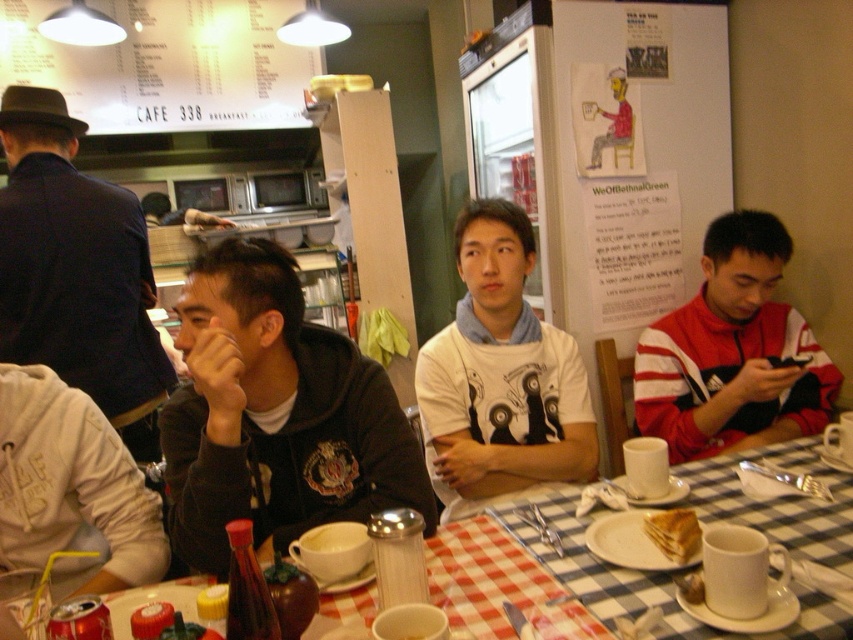
Does translucent plastic bottle at table center appear over golden crispy pastry at lower center?

Yes.

From the picture: Who is lower down, translucent plastic bottle at table center or golden crispy pastry at lower center?

golden crispy pastry at lower center is below.

What do you see at coordinates (247, 589) in the screenshot? I see `translucent plastic bottle at table center` at bounding box center [247, 589].

The width and height of the screenshot is (853, 640). I want to click on translucent plastic bottle at table center, so click(247, 589).

Does dark blue jacket at left have a smaller size compared to golden crispy pastry at lower center?

Actually, dark blue jacket at left might be larger than golden crispy pastry at lower center.

Which is more to the left, dark blue jacket at left or golden crispy pastry at lower center?

dark blue jacket at left

Between point (45, 156) and point (660, 513), which one is positioned behind?

Positioned behind is point (45, 156).

Find the location of a particular element. The height and width of the screenshot is (640, 853). dark blue jacket at left is located at coordinates (76, 272).

Between point (670, 426) and point (693, 529), which one is positioned behind?

The point (670, 426) is behind.

Who is positioned more to the left, red and white striped hoodie at right or golden crispy pastry at lower center?

golden crispy pastry at lower center is more to the left.

Describe the element at coordinates (733, 353) in the screenshot. This screenshot has height=640, width=853. I see `red and white striped hoodie at right` at that location.

This screenshot has width=853, height=640. I want to click on red and white striped hoodie at right, so click(x=733, y=353).